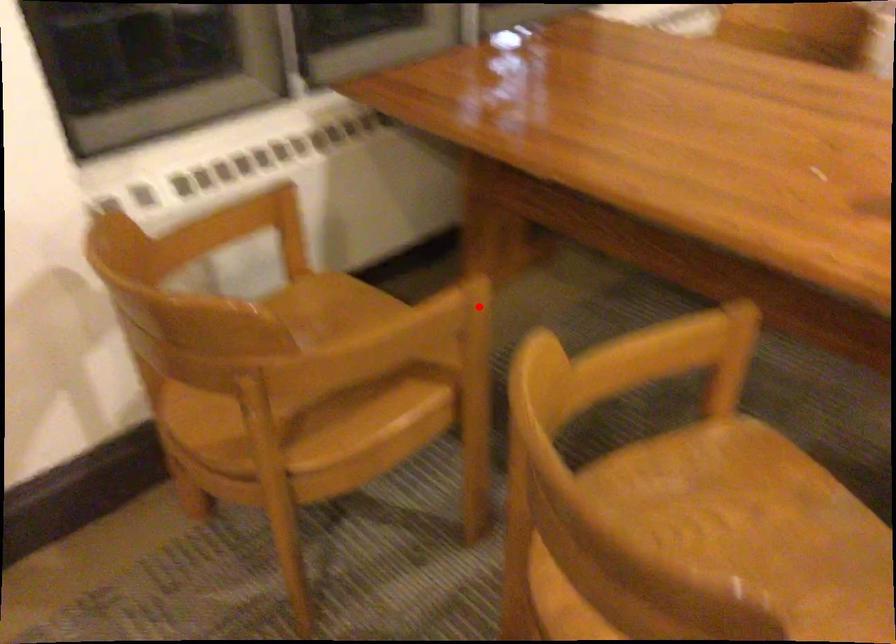
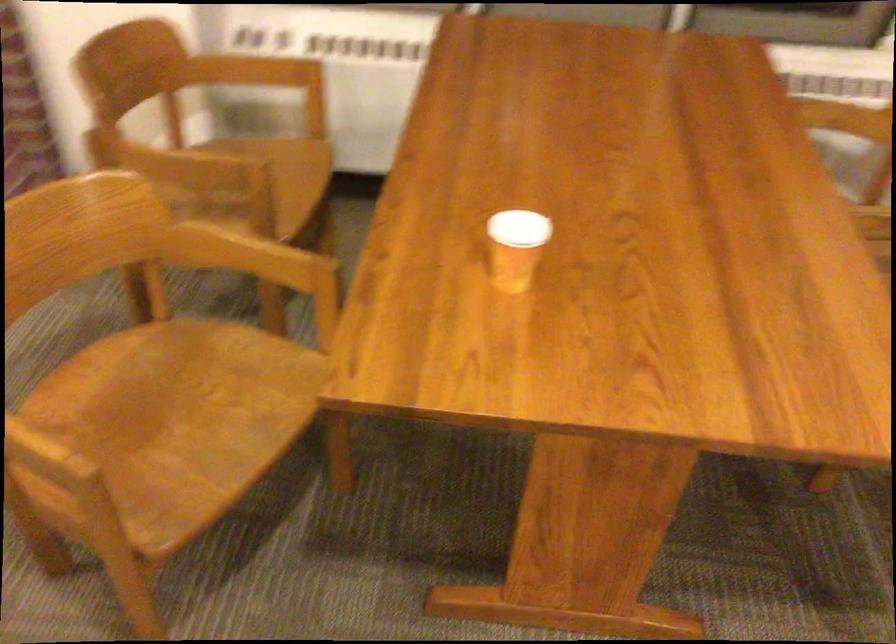
Where in the second image is the point corresponding to the highlighted location from the first image?

(252, 182)